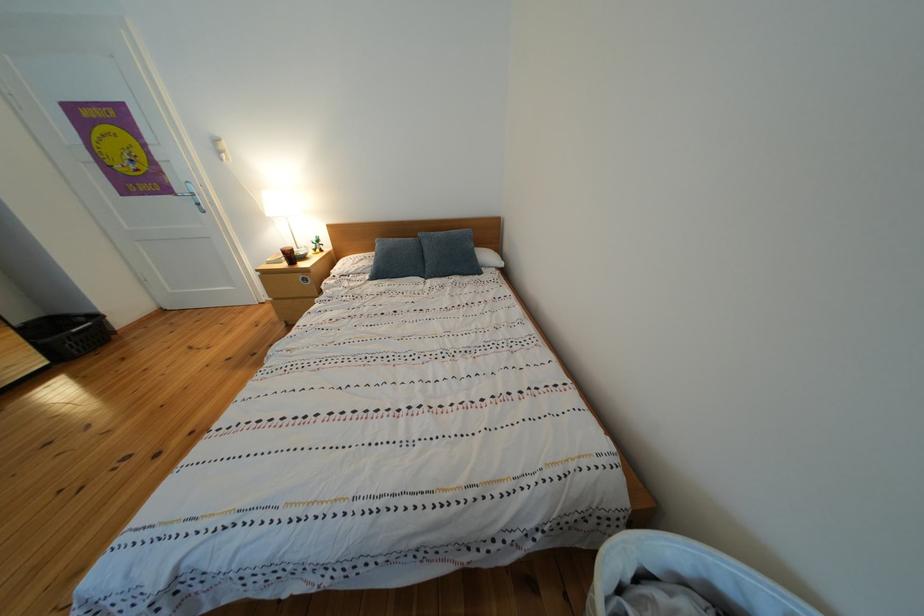
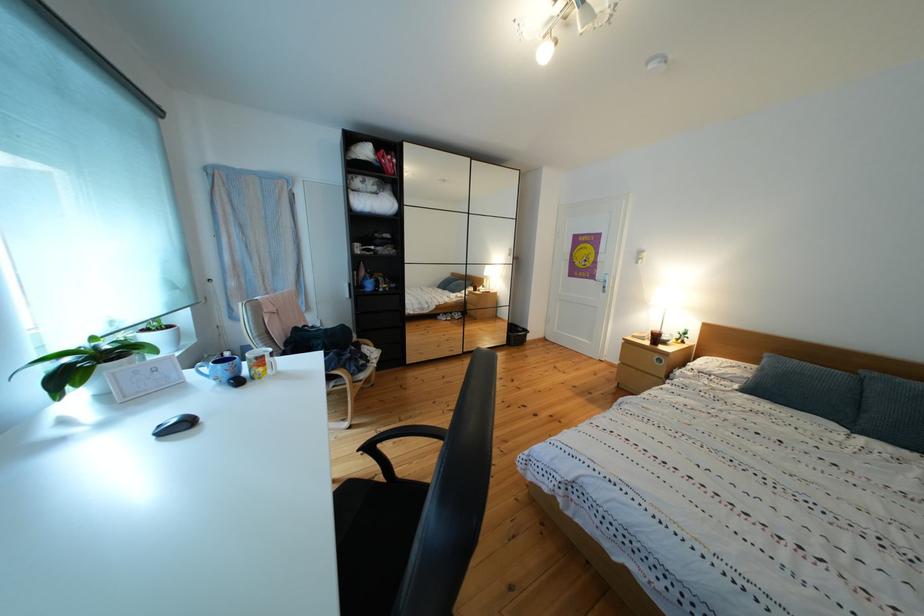
Locate, in the second image, the point that corresponds to point 179,196 in the first image.

(603, 283)